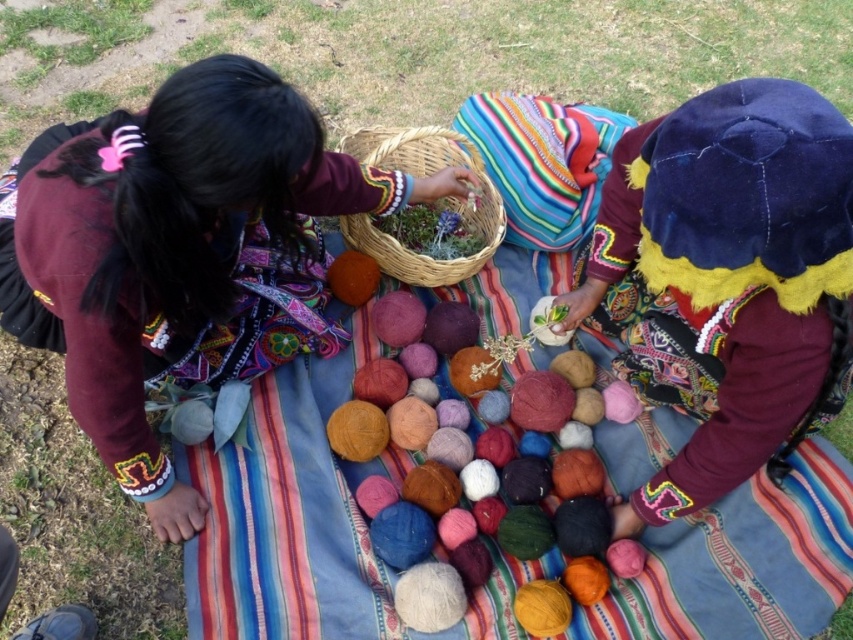
Who is higher up, matte woolen yarn balls at center or soft wool balls at center?

matte woolen yarn balls at center is above.

Looking at this image, does matte woolen yarn balls at center have a greater height compared to soft wool balls at center?

Yes, matte woolen yarn balls at center is taller than soft wool balls at center.

Is point (419, 198) closer to camera compared to point (451, 362)?

No, it is not.

You are a GUI agent. You are given a task and a screenshot of the screen. Output one action in this format:
    pyautogui.click(x=<x>, y=<y>)
    Task: Click on the matte woolen yarn balls at center
    
    Given the screenshot: What is the action you would take?
    pyautogui.click(x=183, y=252)

Does velvet blue hat at upper right have a lesser width compared to woven natural basket at center?

No.

Consider the image. Which is below, velvet blue hat at upper right or woven natural basket at center?

velvet blue hat at upper right

The image size is (853, 640). I want to click on velvet blue hat at upper right, so click(x=726, y=282).

Where is `velvet blue hat at upper right`? The width and height of the screenshot is (853, 640). velvet blue hat at upper right is located at coordinates (726, 282).

Is the position of velvet blue hat at upper right less distant than that of soft wool balls at center?

Yes, velvet blue hat at upper right is closer to the viewer.

Is point (693, 472) positioned after point (569, 401)?

No, (693, 472) is in front of (569, 401).

Where is `velvet blue hat at upper right`? The height and width of the screenshot is (640, 853). velvet blue hat at upper right is located at coordinates (726, 282).

You are a GUI agent. You are given a task and a screenshot of the screen. Output one action in this format:
    pyautogui.click(x=<x>, y=<y>)
    Task: Click on the velvet blue hat at upper right
    
    Given the screenshot: What is the action you would take?
    pyautogui.click(x=726, y=282)